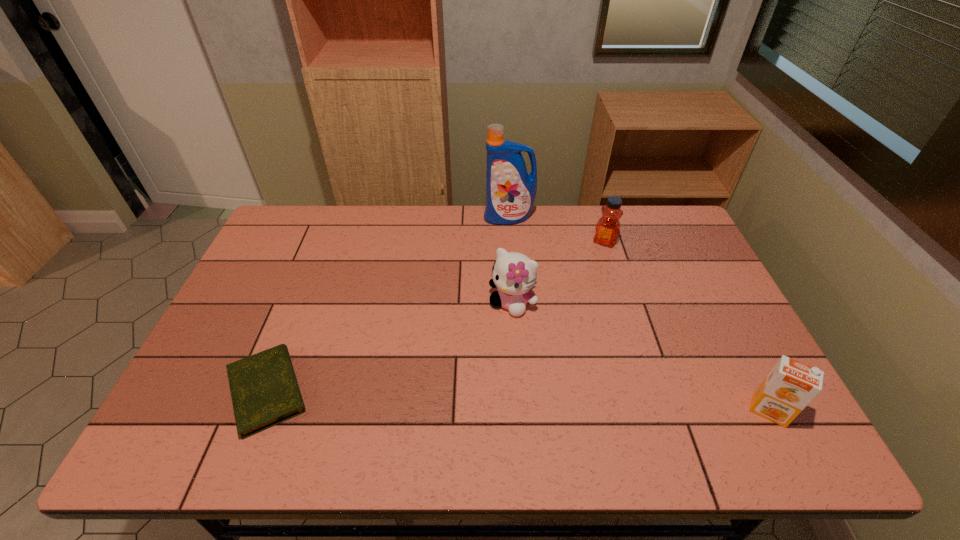
Find the location of a particular element. This screenshot has height=540, width=960. empty space between the third farthest object and the fourth object from left to right is located at coordinates (559, 272).

At what (x,y) coordinates should I click in order to perform the action: click on object identified as the second closest to the third nearest object. Please return your answer as a coordinate pair (x, y). Looking at the image, I should click on (510, 190).

Locate an element on the screen. object that stands as the closest to the orange juice is located at coordinates (514, 274).

Where is `blank space that satisfies the following two spatial constraints: 1. on the front side of the diary; 2. on the left side of the rightmost object`? This screenshot has width=960, height=540. blank space that satisfies the following two spatial constraints: 1. on the front side of the diary; 2. on the left side of the rightmost object is located at coordinates (259, 410).

What are the coordinates of `free point that satisfies the following two spatial constraints: 1. on the back side of the kitten; 2. on the left side of the shortest object` in the screenshot? It's located at (301, 303).